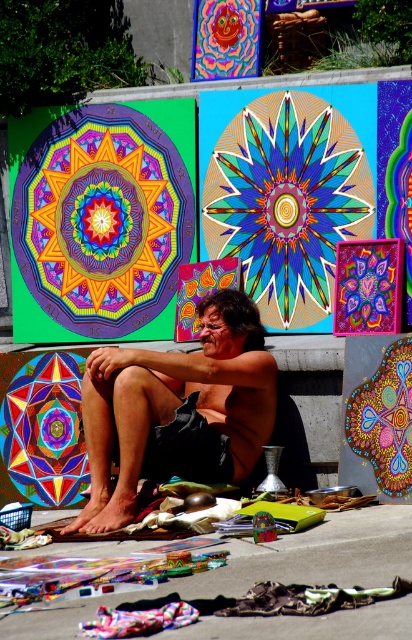
You are a photographer wanting to capture the vibrant painted mandala at center and the textured fabric at lower center in a single shot. Which object should you focus on first to ensure both are in frame?

The textured fabric at lower center is located below the vibrant painted mandala at center, so you should focus on the vibrant painted mandala at center first to ensure both are in frame.